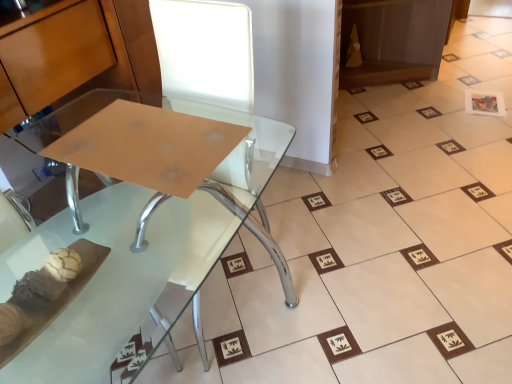
You are a GUI agent. You are given a task and a screenshot of the screen. Output one action in this format:
    pyautogui.click(x=<x>, y=<y>)
    Task: Click on the white paper at upper right
    Image resolution: width=512 pixels, height=384 pixels.
    Given the screenshot: What is the action you would take?
    pyautogui.click(x=485, y=103)

Measure the distance between point (498,109) and camera.

The depth of point (498,109) is 2.42 meters.

In order to face white paper at upper right, should I rotate leftwards or rightwards?

Rotate right and turn 28.542 degrees.

This screenshot has width=512, height=384. What do you see at coordinates (485, 103) in the screenshot?
I see `white paper at upper right` at bounding box center [485, 103].

Image resolution: width=512 pixels, height=384 pixels. Identify the location of clear glass table at center. (140, 230).

In order to face clear glass table at center, should I rotate leftwards or rightwards?

Rotate your view left by about 14.134°.

The height and width of the screenshot is (384, 512). What do you see at coordinates (140, 230) in the screenshot? I see `clear glass table at center` at bounding box center [140, 230].

Measure the distance between clear glass table at center and camera.

clear glass table at center is 77.36 centimeters away from camera.

Identify the location of white paper at upper right. (485, 103).

Between clear glass table at center and white paper at upper right, which one appears on the right side from the viewer's perspective?

Positioned to the right is white paper at upper right.

Is clear glass table at center positioned in front of white paper at upper right?

Yes, clear glass table at center is closer to the camera.

Is point (238, 158) closer or farther from the camera than point (474, 92)?

Point (238, 158) appears to be closer to the viewer than point (474, 92).

From the image's perspective, relative to white paper at upper right, is clear glass table at center above or below?

Answer: clear glass table at center is below white paper at upper right.

From a real-world perspective, between clear glass table at center and white paper at upper right, who is vertically lower?

white paper at upper right, from a real-world perspective.

In terms of width, does clear glass table at center look wider or thinner when compared to white paper at upper right?

clear glass table at center is wider than white paper at upper right.

Between clear glass table at center and white paper at upper right, which one has less height?

white paper at upper right.

Considering the relative sizes of clear glass table at center and white paper at upper right in the image provided, is clear glass table at center bigger than white paper at upper right?

Indeed, clear glass table at center has a larger size compared to white paper at upper right.

Would you say clear glass table at center is inside or outside white paper at upper right?

clear glass table at center is spatially situated outside white paper at upper right.

Does clear glass table at center touch white paper at upper right?

No, clear glass table at center is not with white paper at upper right.

Is clear glass table at center turned away from white paper at upper right?

No.

How many degrees apart are the facing directions of clear glass table at center and white paper at upper right?

82.8 degrees.

Where is `square above the clear glass table at center (from the image's perspective)`? This screenshot has width=512, height=384. square above the clear glass table at center (from the image's perspective) is located at coordinates (485, 103).

Visually, is white paper at upper right positioned to the left or to the right of clear glass table at center?

Clearly, white paper at upper right is on the right of clear glass table at center in the image.

Is white paper at upper right behind clear glass table at center?

Yes, it is.

Is point (500, 94) closer to camera compared to point (62, 126)?

That is False.

Looking at this image, from the image's perspective, relative to clear glass table at center, is white paper at upper right above or below?

white paper at upper right is above clear glass table at center.

From a real-world perspective, is white paper at upper right physically above clear glass table at center?

Actually, white paper at upper right is physically below clear glass table at center in the real world.

Considering the sizes of objects white paper at upper right and clear glass table at center in the image provided, who is thinner, white paper at upper right or clear glass table at center?

white paper at upper right.

In terms of height, does white paper at upper right look taller or shorter compared to clear glass table at center?

In the image, white paper at upper right appears to be shorter than clear glass table at center.

Who is bigger, white paper at upper right or clear glass table at center?

With larger size is clear glass table at center.

Does white paper at upper right contain clear glass table at center?

That's incorrect, clear glass table at center is not inside white paper at upper right.

Is white paper at upper right next to clear glass table at center and touching it?

No, white paper at upper right is not next to clear glass table at center.

Is white paper at upper right looking in the opposite direction of clear glass table at center?

No, white paper at upper right is not facing the opposite direction of clear glass table at center.

What's the angular difference between white paper at upper right and clear glass table at center's facing directions?

82.8 degrees.

Measure the distance from white paper at upper right to clear glass table at center.

white paper at upper right and clear glass table at center are 2.02 meters apart from each other.

Where is `square that is on the right side of clear glass table at center`? This screenshot has height=384, width=512. square that is on the right side of clear glass table at center is located at coordinates (485, 103).

There is a white paper at upper right. At what (x,y) coordinates should I click in order to perform the action: click on table above it (from a real-world perspective). Please return your answer as a coordinate pair (x, y). The height and width of the screenshot is (384, 512). Looking at the image, I should click on (140, 230).

Locate an element on the screen. The height and width of the screenshot is (384, 512). table that is in front of the white paper at upper right is located at coordinates (140, 230).